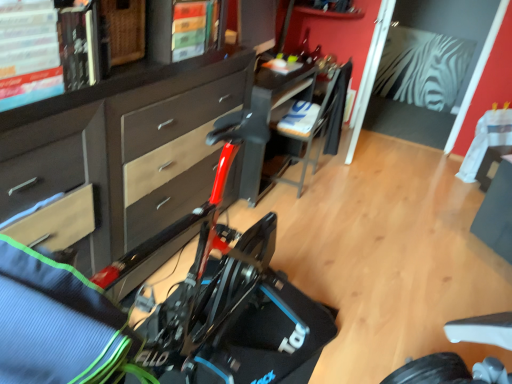
Find the location of a particular element. black plastic chair at center is located at coordinates (317, 122).

Find the location of a particular element. This screenshot has width=512, height=384. matte brown cabinet at center is located at coordinates (118, 155).

Is black plastic chair at center positioned with its back to matte brown cabinet at center?

No.

Is black plastic chair at center beside matte brown cabinet at center?

No, black plastic chair at center is not with matte brown cabinet at center.

Can you confirm if black plastic chair at center is positioned to the left of matte brown cabinet at center?

Incorrect, black plastic chair at center is not on the left side of matte brown cabinet at center.

From a real-world perspective, is black plastic chair at center physically located above or below matte brown cabinet at center?

black plastic chair at center is situated lower than matte brown cabinet at center in the real world.

Is point (291, 78) less distant than point (178, 212)?

No.

Does black plastic table at center have a larger size compared to matte brown cabinet at center?

Actually, black plastic table at center might be smaller than matte brown cabinet at center.

Where is `cabinetry that appears on the left of black plastic table at center`? The image size is (512, 384). cabinetry that appears on the left of black plastic table at center is located at coordinates (118, 155).

Does black plastic table at center have a greater width compared to matte brown cabinet at center?

Correct, the width of black plastic table at center exceeds that of matte brown cabinet at center.

Which is closer to the camera, (262, 153) or (324, 145)?

Clearly, point (262, 153) is closer to the camera than point (324, 145).

Can you confirm if black plastic table at center is thinner than black plastic chair at center?

No.

Looking at this image, does black plastic table at center appear on the left side of black plastic chair at center?

Yes, black plastic table at center is to the left of black plastic chair at center.

Consider the image. Considering the sizes of objects black plastic table at center and black plastic chair at center in the image provided, who is bigger, black plastic table at center or black plastic chair at center?

With larger size is black plastic table at center.

From the image's perspective, which one is positioned higher, matte brown cabinet at center or black plastic chair at center?

black plastic chair at center appears higher in the image.

Considering the relative sizes of matte brown cabinet at center and black plastic chair at center in the image provided, is matte brown cabinet at center thinner than black plastic chair at center?

Indeed, matte brown cabinet at center has a lesser width compared to black plastic chair at center.

Is matte brown cabinet at center surrounding black plastic chair at center?

No, black plastic chair at center is not a part of matte brown cabinet at center.

From a real-world perspective, does matte brown cabinet at center sit lower than black plastic table at center?

Incorrect, from a real-world perspective, matte brown cabinet at center is higher than black plastic table at center.

Where is `table that is above the matte brown cabinet at center (from the image's perspective)`? table that is above the matte brown cabinet at center (from the image's perspective) is located at coordinates (281, 88).

From the picture: Who is taller, matte brown cabinet at center or black plastic table at center?

Standing taller between the two is matte brown cabinet at center.

Considering the sizes of objects matte brown cabinet at center and black plastic table at center in the image provided, who is smaller, matte brown cabinet at center or black plastic table at center?

Smaller between the two is black plastic table at center.

This screenshot has width=512, height=384. Identify the location of chair located behind the black plastic table at center. (317, 122).

Between point (337, 117) and point (278, 97), which one is positioned behind?

The point (337, 117) is farther from the camera.

Is black plastic chair at center taller or shorter than black plastic table at center?

black plastic chair at center is taller than black plastic table at center.

Where is `cabinetry on the left of black plastic chair at center`? cabinetry on the left of black plastic chair at center is located at coordinates (118, 155).

The width and height of the screenshot is (512, 384). What are the coordinates of `table behind the matte brown cabinet at center` in the screenshot? It's located at (281, 88).

Consider the image. Based on their spatial positions, is matte brown cabinet at center or black plastic table at center further from black plastic chair at center?

matte brown cabinet at center is positioned further to the anchor black plastic chair at center.

From the image, which object appears to be nearer to matte brown cabinet at center, black plastic table at center or black plastic chair at center?

Based on the image, black plastic table at center appears to be nearer to matte brown cabinet at center.

Estimate the real-world distances between objects in this image. Which object is further from black plastic table at center, black plastic chair at center or matte brown cabinet at center?

matte brown cabinet at center is positioned further to the anchor black plastic table at center.

Estimate the real-world distances between objects in this image. Which object is further from black plastic table at center, matte brown cabinet at center or black plastic chair at center?

matte brown cabinet at center is further to black plastic table at center.

Which object lies nearer to the anchor point matte brown cabinet at center, black plastic chair at center or black plastic table at center?

black plastic table at center lies closer to matte brown cabinet at center than the other object.

Looking at the image, which one is located further to black plastic chair at center, black plastic table at center or matte brown cabinet at center?

matte brown cabinet at center is positioned further to the anchor black plastic chair at center.

Identify the location of table between matte brown cabinet at center and black plastic chair at center in the front-back direction. (281, 88).